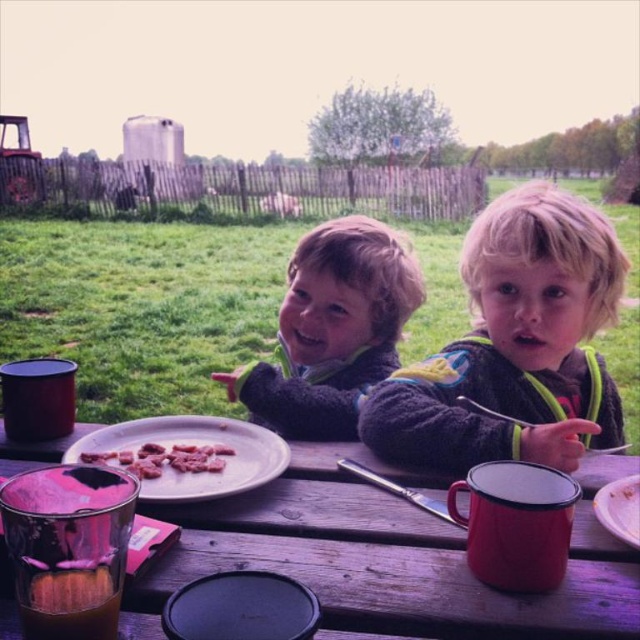
Does soft gray sweater at center come in front of white matte plate at center?

No, soft gray sweater at center is further to the viewer.

Identify the location of soft gray sweater at center. This screenshot has width=640, height=640. (332, 330).

Locate an element on the screen. The height and width of the screenshot is (640, 640). soft gray sweater at center is located at coordinates (332, 330).

Identify the location of soft gray sweater at center. (332, 330).

In the scene shown: Can you confirm if wooden table at center is positioned to the left of white matte plate at lower right?

Yes, wooden table at center is to the left of white matte plate at lower right.

Can you confirm if wooden table at center is shorter than white matte plate at lower right?

No, wooden table at center is not shorter than white matte plate at lower right.

Does point (145, 598) lie in front of point (605, 490)?

Yes, point (145, 598) is in front of point (605, 490).

Where is `wooden table at center`? The width and height of the screenshot is (640, 640). wooden table at center is located at coordinates click(388, 561).

Which is more to the right, pinkish matte meat at center or white matte plate at lower right?

Positioned to the right is white matte plate at lower right.

Between pinkish matte meat at center and white matte plate at lower right, which one is positioned lower?

white matte plate at lower right is below.

Describe the element at coordinates (164, 458) in the screenshot. I see `pinkish matte meat at center` at that location.

Image resolution: width=640 pixels, height=640 pixels. In order to click on pinkish matte meat at center in this screenshot , I will do `click(164, 458)`.